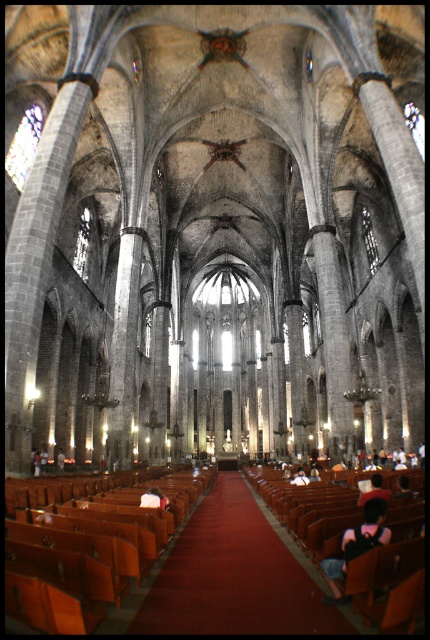
Is wooden polished chair at center thinner than stained glass window at left?

In fact, wooden polished chair at center might be wider than stained glass window at left.

Based on the photo, is wooden polished chair at center to the right of stained glass window at left from the viewer's perspective?

Correct, you'll find wooden polished chair at center to the right of stained glass window at left.

Between point (353, 508) and point (27, 115), which one is positioned in front?

Point (353, 508)

This screenshot has width=430, height=640. Find the location of `wooden polished chair at center`. wooden polished chair at center is located at coordinates (383, 576).

Is stained glass window at left to the left of transparent glass window at upper right from the viewer's perspective?

Yes, stained glass window at left is to the left of transparent glass window at upper right.

Locate an element on the screen. The height and width of the screenshot is (640, 430). stained glass window at left is located at coordinates (24, 145).

Which is behind, point (21, 180) or point (415, 138)?

The point (415, 138) is more distant.

The height and width of the screenshot is (640, 430). What are the coordinates of `stained glass window at left` in the screenshot? It's located at (24, 145).

Does transparent glass window at center have a smaller size compared to transparent glass window at upper right?

Yes, transparent glass window at center is smaller than transparent glass window at upper right.

Which is behind, point (82, 273) or point (423, 150)?

Positioned behind is point (82, 273).

Is point (89, 209) positioned before point (415, 124)?

No.

What are the coordinates of `transparent glass window at center` in the screenshot? It's located at (82, 244).